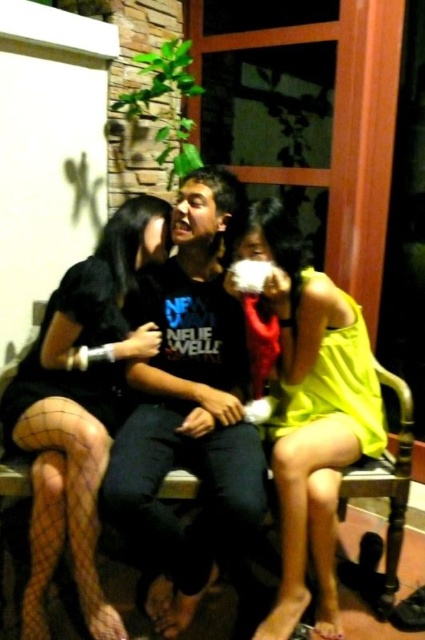
Question: Can you confirm if black matte shirt at center is bigger than yellow matte dress at center?

Choices:
 (A) yes
 (B) no

Answer: (A)

Question: Can you confirm if black matte shirt at center is wider than yellow matte dress at center?

Choices:
 (A) yes
 (B) no

Answer: (B)

Question: Which object is closer to the camera taking this photo?

Choices:
 (A) black mesh stockings at lower left
 (B) black matte shirt at center

Answer: (B)

Question: Among these points, which one is farthest from the camera?

Choices:
 (A) (104, 269)
 (B) (147, 454)
 (C) (65, 413)

Answer: (A)

Question: Which object is closer to the camera taking this photo?

Choices:
 (A) yellow satin dress at right
 (B) black fishnet stockings at left

Answer: (B)

Question: Considering the relative positions of black fishnet stockings at left and black mesh stockings at lower left in the image provided, where is black fishnet stockings at left located with respect to black mesh stockings at lower left?

Choices:
 (A) below
 (B) above

Answer: (A)